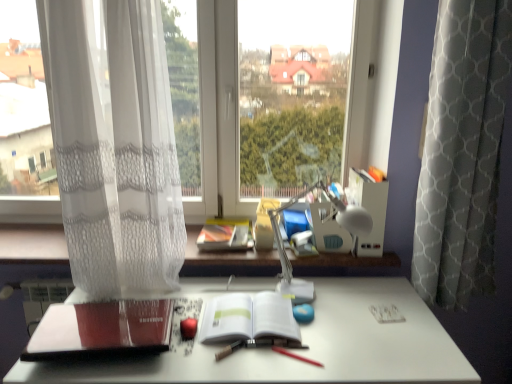
Locate an element on the screen. This screenshot has width=512, height=384. vacant area on the back side of smooth red crayon at center is located at coordinates (307, 335).